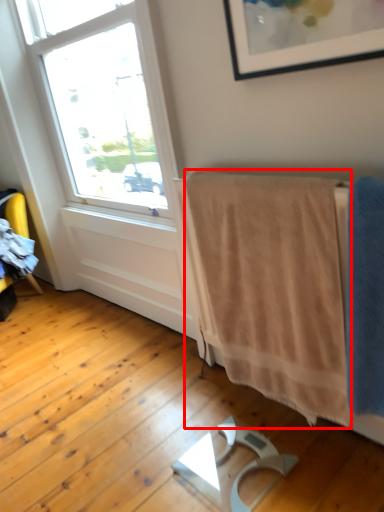
Question: Considering the relative positions of bath towel (annotated by the red box) and bath towel in the image provided, where is bath towel (annotated by the red box) located with respect to the staircase?

Choices:
 (A) right
 (B) left

Answer: (B)